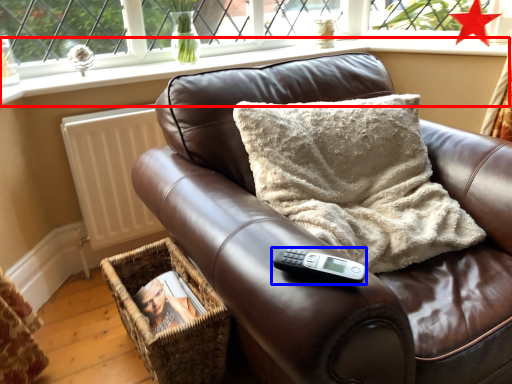
Question: Which object appears closest to the camera in this image, window sill (highlighted by a red box) or remote (highlighted by a blue box)?

Choices:
 (A) window sill
 (B) remote

Answer: (B)